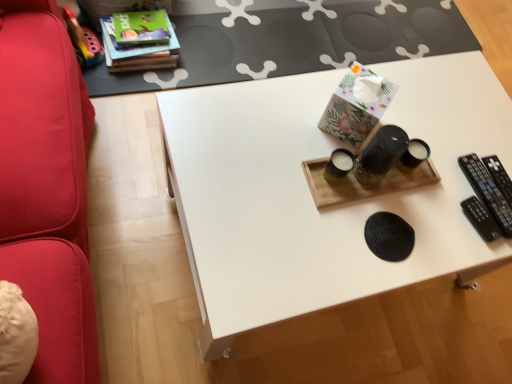
Locate an element on the screen. free space to the right of hardcover book at upper left is located at coordinates (201, 54).